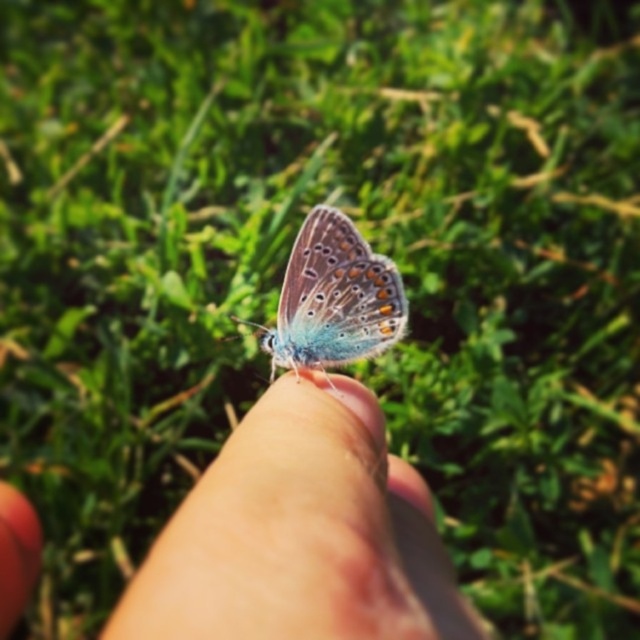
Can you confirm if smooth skin finger at center is bigger than translucent iridescent butterfly at center?

Yes.

Can you confirm if smooth skin finger at center is shorter than translucent iridescent butterfly at center?

Yes.

Find the location of a particular element. This screenshot has width=640, height=640. smooth skin finger at center is located at coordinates (300, 532).